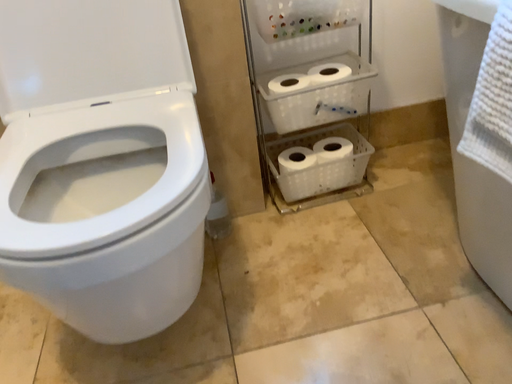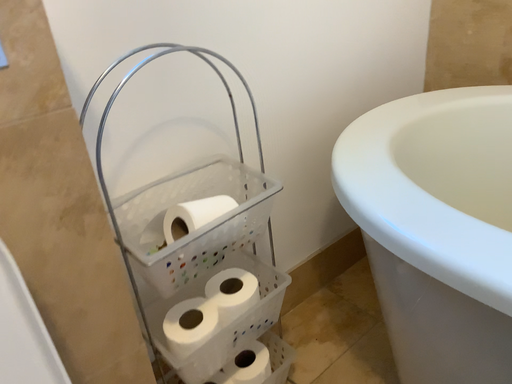
Question: How did the camera likely rotate when shooting the video?

Choices:
 (A) rotated downward
 (B) rotated upward

Answer: (B)